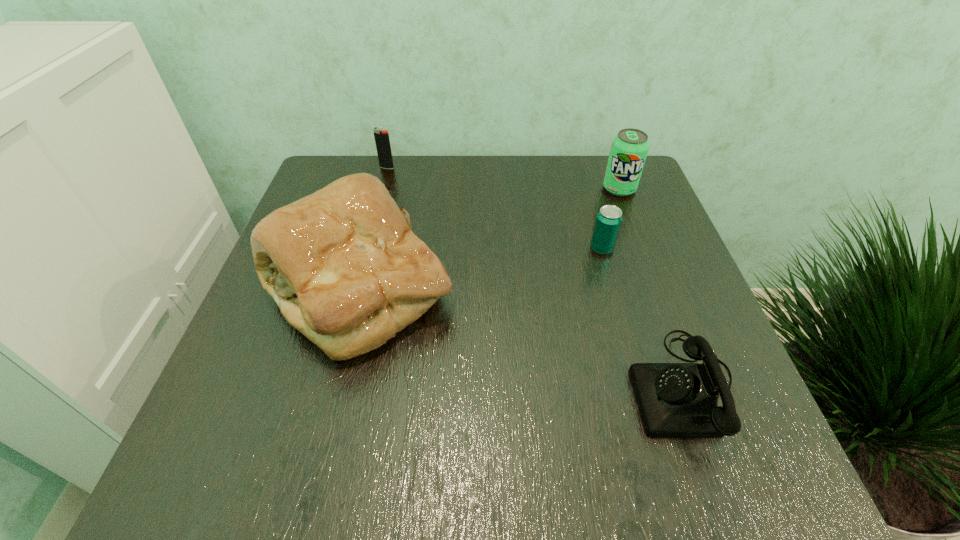
Identify the location of telephone situated at the right edge. (675, 400).

Where is `object that is at the far left corner`? object that is at the far left corner is located at coordinates (382, 141).

I want to click on object at the far right corner, so click(629, 148).

Find the location of a particular element. The height and width of the screenshot is (540, 960). object positioned at the near right corner is located at coordinates (675, 400).

In the image, there is a desktop. Find the location of `vacant space at the far edge`. vacant space at the far edge is located at coordinates 408,164.

What are the coordinates of `vacant space at the near edge` in the screenshot? It's located at (484, 449).

Find the location of a particular element. free space at the left edge is located at coordinates (246, 423).

The width and height of the screenshot is (960, 540). What are the coordinates of `vacant space at the right edge of the desktop` in the screenshot? It's located at (628, 260).

The width and height of the screenshot is (960, 540). I want to click on vacant area at the far left corner of the desktop, so click(x=365, y=163).

Find the location of a particular element. Image resolution: width=960 pixels, height=540 pixels. free spot at the near left corner of the desktop is located at coordinates (226, 438).